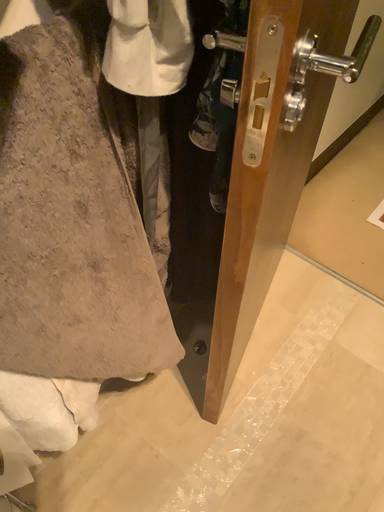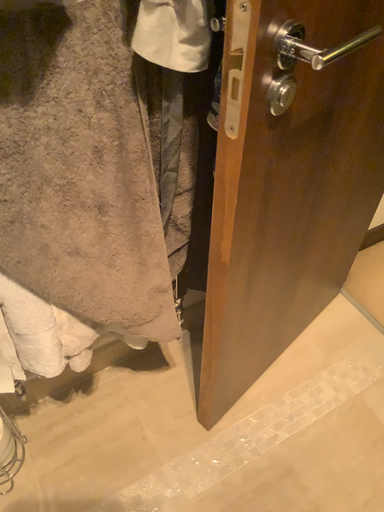
Question: Which way did the camera rotate in the video?

Choices:
 (A) rotated right
 (B) rotated left

Answer: (B)